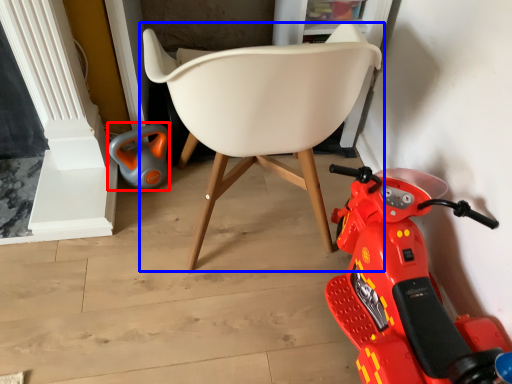
Question: Which point is further to the camera, toy (highlighted by a red box) or chair (highlighted by a blue box)?

Choices:
 (A) toy
 (B) chair

Answer: (A)